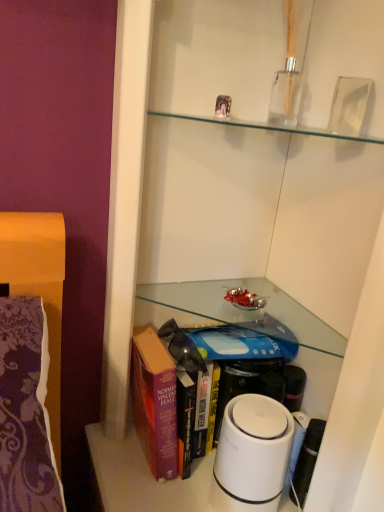
Where is `free space to the left of white plastic humidifier at lower center`? The width and height of the screenshot is (384, 512). free space to the left of white plastic humidifier at lower center is located at coordinates (151, 478).